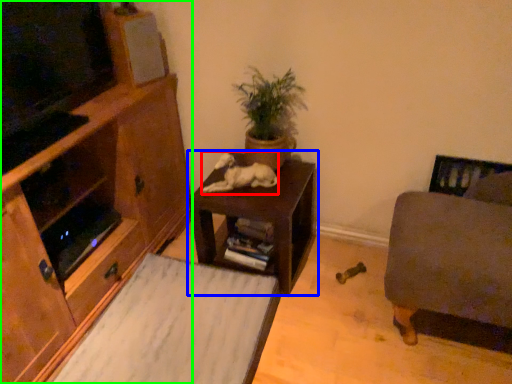
Question: Which is nearer to the animal (highlighted by a red box)? table (highlighted by a blue box) or cabinetry (highlighted by a green box).

Choices:
 (A) table
 (B) cabinetry

Answer: (A)